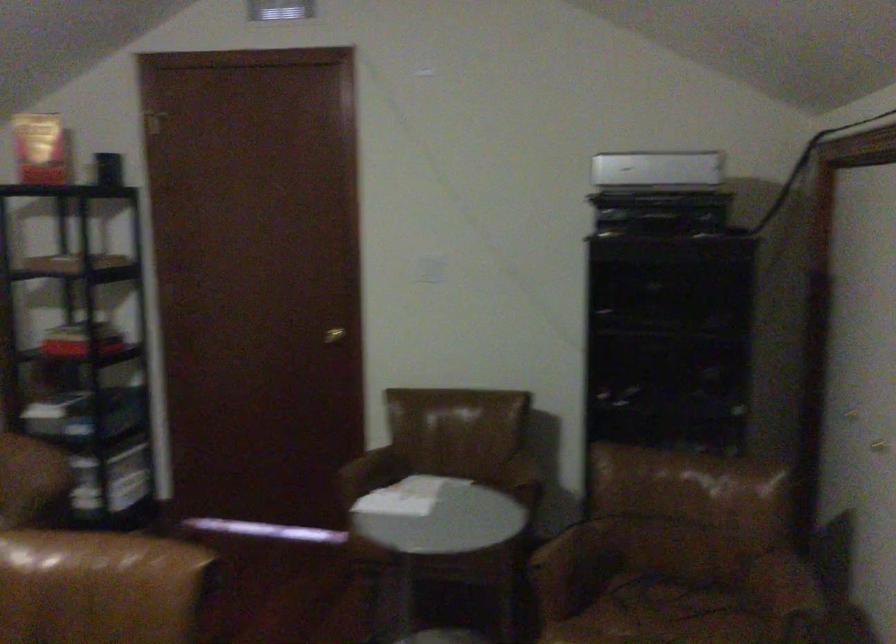
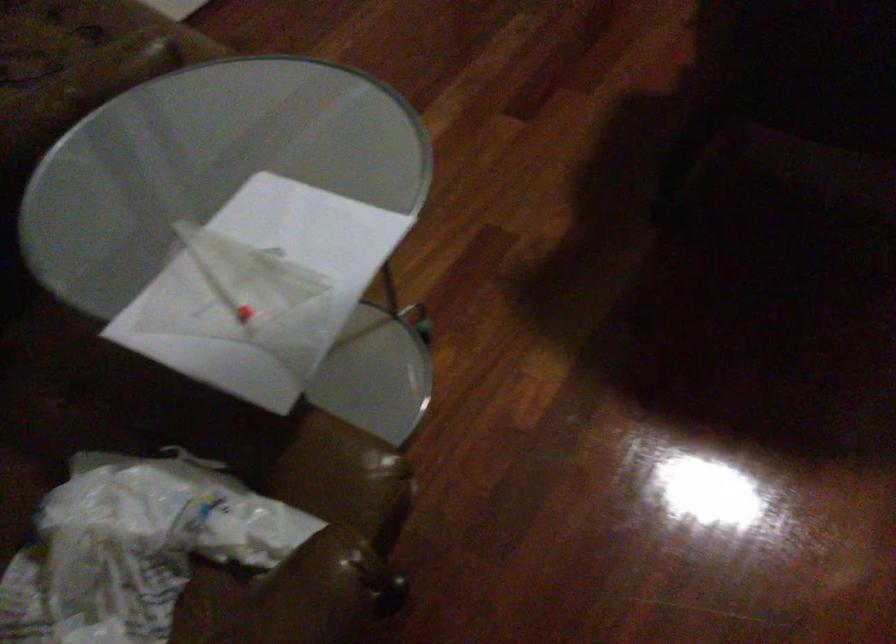
Locate, in the second image, the point that corresponds to point 410,494 in the first image.

(134, 547)